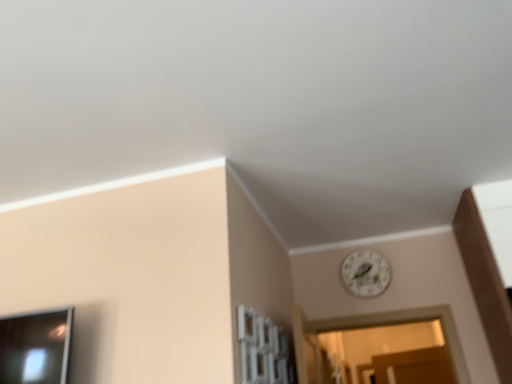
Question: Is white frosted glass window at center wider or thinner than white floral clock at upper center?

Choices:
 (A) wide
 (B) thin

Answer: (A)

Question: Is white frosted glass window at center to the left or to the right of white floral clock at upper center in the image?

Choices:
 (A) right
 (B) left

Answer: (B)

Question: In terms of height, does white frosted glass window at center look taller or shorter compared to white floral clock at upper center?

Choices:
 (A) short
 (B) tall

Answer: (A)

Question: Considering the relative positions of white floral clock at upper center and white frosted glass window at center in the image provided, is white floral clock at upper center to the left or to the right of white frosted glass window at center?

Choices:
 (A) left
 (B) right

Answer: (B)

Question: From a real-world perspective, is white floral clock at upper center positioned above or below white frosted glass window at center?

Choices:
 (A) above
 (B) below

Answer: (A)

Question: Considering the positions of point (380, 271) and point (251, 357), is point (380, 271) closer or farther from the camera than point (251, 357)?

Choices:
 (A) closer
 (B) farther

Answer: (B)

Question: Is white floral clock at upper center wider or thinner than white frosted glass window at center?

Choices:
 (A) thin
 (B) wide

Answer: (A)